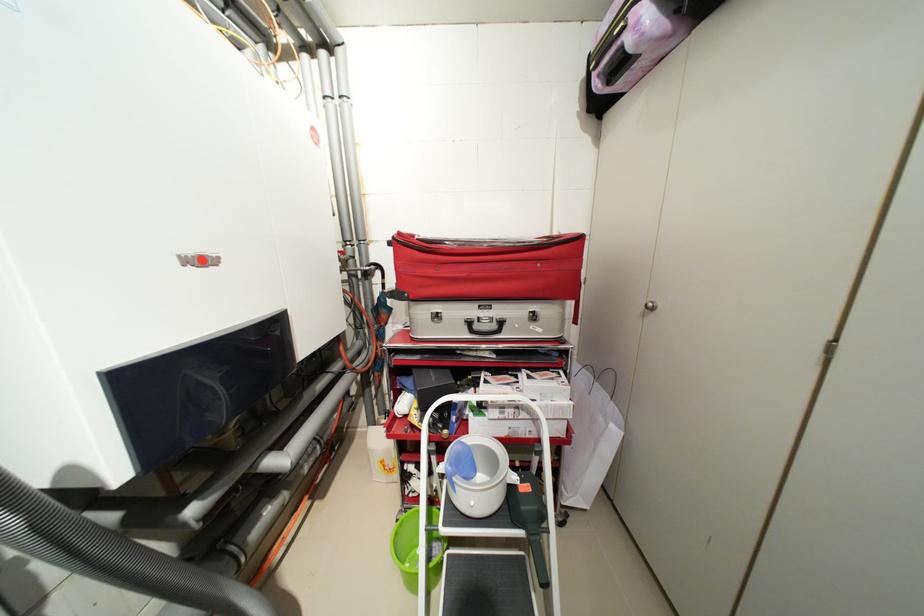
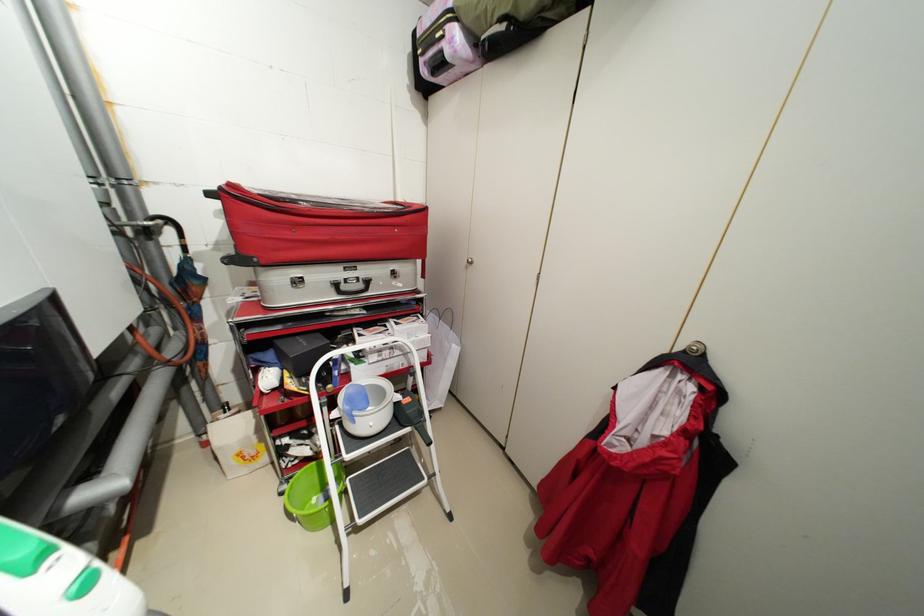
Question: The camera is either moving clockwise (left) or counter-clockwise (right) around the object. The first image is from the beginning of the video and the second image is from the end. Is the camera moving left or right when shooting the video?

Choices:
 (A) Left
 (B) Right

Answer: (A)